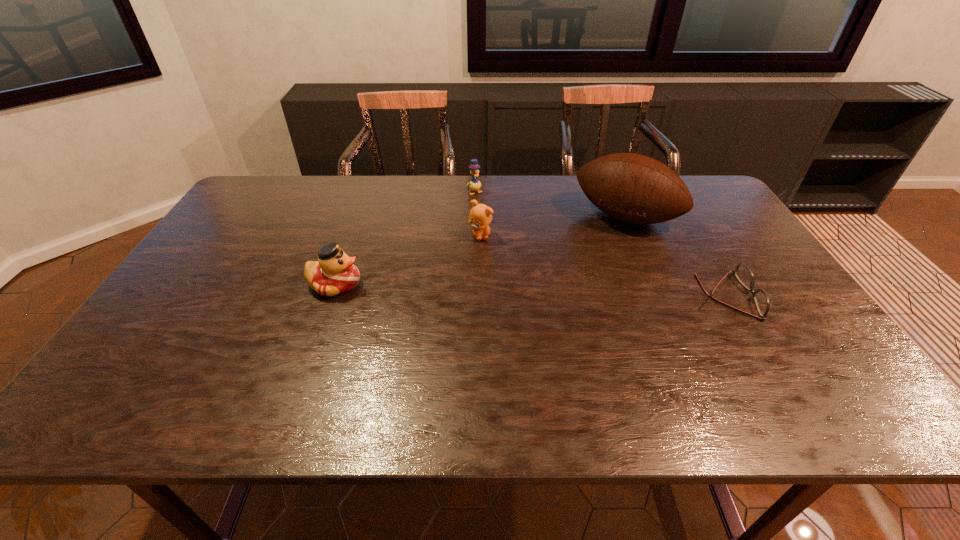
The width and height of the screenshot is (960, 540). I want to click on vacant space at the near edge of the desktop, so click(x=624, y=359).

In order to click on vacant space at the left edge in this screenshot , I will do `click(200, 272)`.

In order to click on free region at the far left corner of the desktop in this screenshot , I will do coord(271,208).

Locate an element on the screen. The height and width of the screenshot is (540, 960). free space at the far right corner of the desktop is located at coordinates (716, 199).

Identify the location of vacant area between the tallest object and the duckling. (550, 205).

What are the coordinates of `vacant space in between the farthest object and the shortest object` in the screenshot? It's located at (599, 244).

I want to click on free space between the duck and the shortest object, so click(529, 290).

The height and width of the screenshot is (540, 960). Find the location of `empty space that is in between the spectacles and the duck`. empty space that is in between the spectacles and the duck is located at coordinates (529, 290).

This screenshot has height=540, width=960. I want to click on empty space that is in between the teddy bear and the leftmost object, so click(x=408, y=260).

Image resolution: width=960 pixels, height=540 pixels. What are the coordinates of `vacant area that lies between the duckling and the shortest object` in the screenshot? It's located at (599, 244).